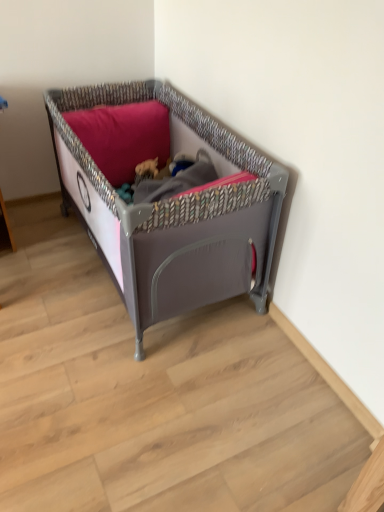
The height and width of the screenshot is (512, 384). Identify the location of free region on the left part of matte gray plastic playpen at center. [x=44, y=258].